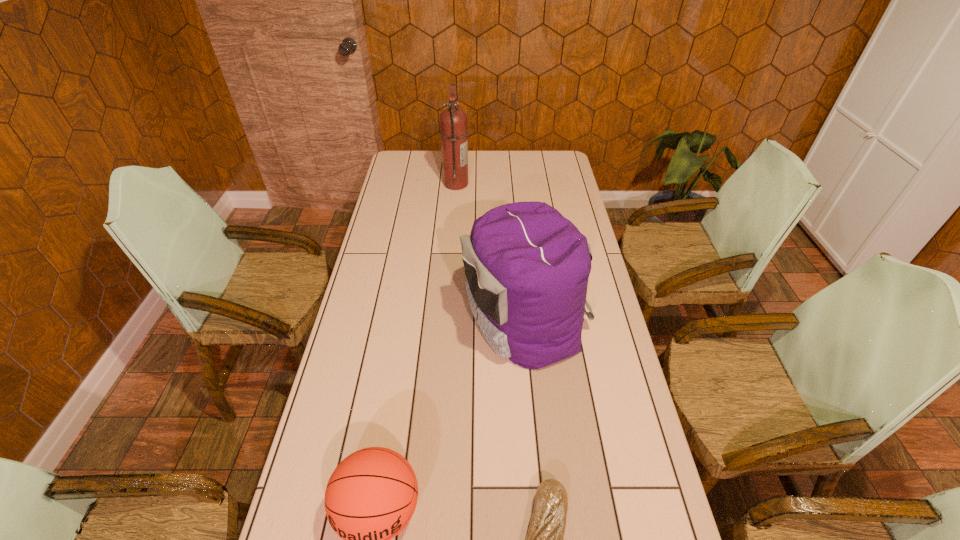
You are a GUI agent. You are given a task and a screenshot of the screen. Output one action in this format:
    pyautogui.click(x=<x>, y=<y>)
    Task: Click on the vacant space at the right edge
    The image size is (960, 540).
    Given the screenshot: What is the action you would take?
    pyautogui.click(x=582, y=220)

The width and height of the screenshot is (960, 540). Identify the location of vacant space at the far left corner of the desktop. click(412, 162).

Locate which object is the second closest to the fire extinguisher. Please provide its 2D coordinates. Your answer should be formatted as a tuple, i.e. [(x, y)], where the tuple contains the x and y coordinates of a point satisfying the conditions above.

[(371, 496)]

Image resolution: width=960 pixels, height=540 pixels. Identify the location of object that is the nearest to the farthest object. (527, 266).